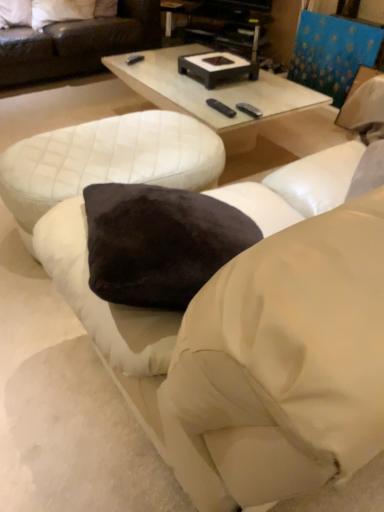
This screenshot has height=512, width=384. Identify the location of free space above white quilted ottoman at lower left (from a real-world perspective). (100, 148).